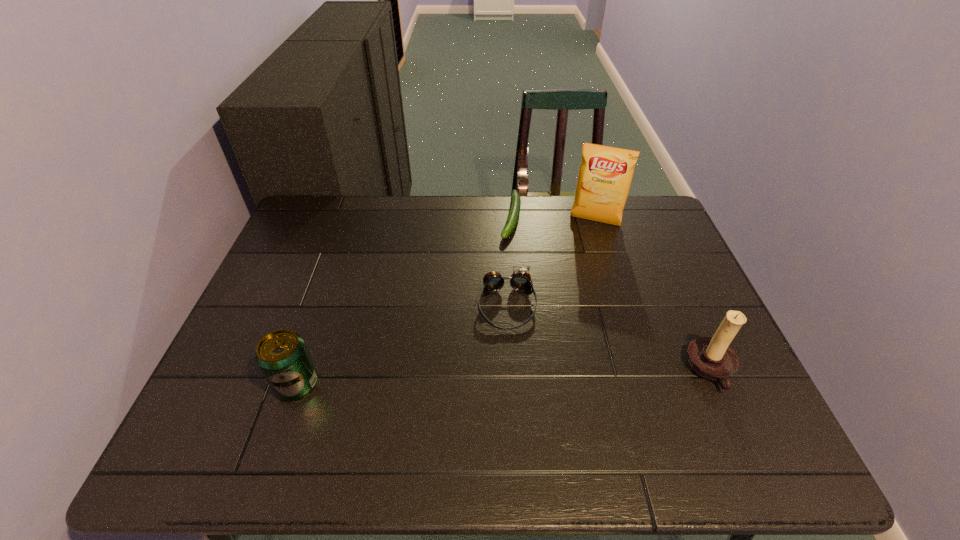
At what (x,y) coordinates should I click in order to perform the action: click on vacant space located 0.080m on the front of the tallest object with the logo. Please return your answer as a coordinate pair (x, y). Looking at the image, I should click on (585, 245).

Image resolution: width=960 pixels, height=540 pixels. I want to click on vacant area situated on the front of the tallest object with the logo, so click(577, 271).

At what (x,y) coordinates should I click in order to perform the action: click on zucchini situated at the far edge. Please return your answer as a coordinate pair (x, y). The height and width of the screenshot is (540, 960). Looking at the image, I should click on (513, 215).

This screenshot has width=960, height=540. I want to click on crisp (potato chip) that is at the far edge, so click(605, 175).

Find the location of a particular element. The height and width of the screenshot is (540, 960). beer can located in the near edge section of the desktop is located at coordinates (282, 356).

At what (x,y) coordinates should I click in order to perform the action: click on candle holder located at the near edge. Please return your answer as a coordinate pair (x, y). Looking at the image, I should click on (710, 357).

Find the location of `object that is at the left edge`. object that is at the left edge is located at coordinates (282, 356).

The image size is (960, 540). In order to click on candle holder present at the right edge in this screenshot , I will do `click(710, 357)`.

Locate an element on the screen. The height and width of the screenshot is (540, 960). crisp (potato chip) that is at the right edge is located at coordinates (605, 175).

You are a GUI agent. You are given a task and a screenshot of the screen. Output one action in this format:
    pyautogui.click(x=<x>, y=<y>)
    Task: Click on the object that is at the near left corner
    
    Given the screenshot: What is the action you would take?
    (x=282, y=356)